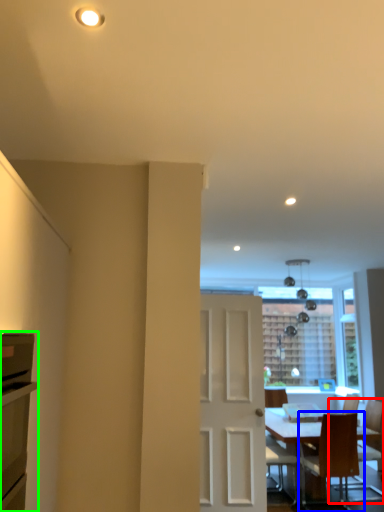
Question: Based on their relative distances, which object is farther from chair (highlighted by a red box)? Choose from chair (highlighted by a blue box) and cabinetry (highlighted by a green box).

Choices:
 (A) chair
 (B) cabinetry

Answer: (B)